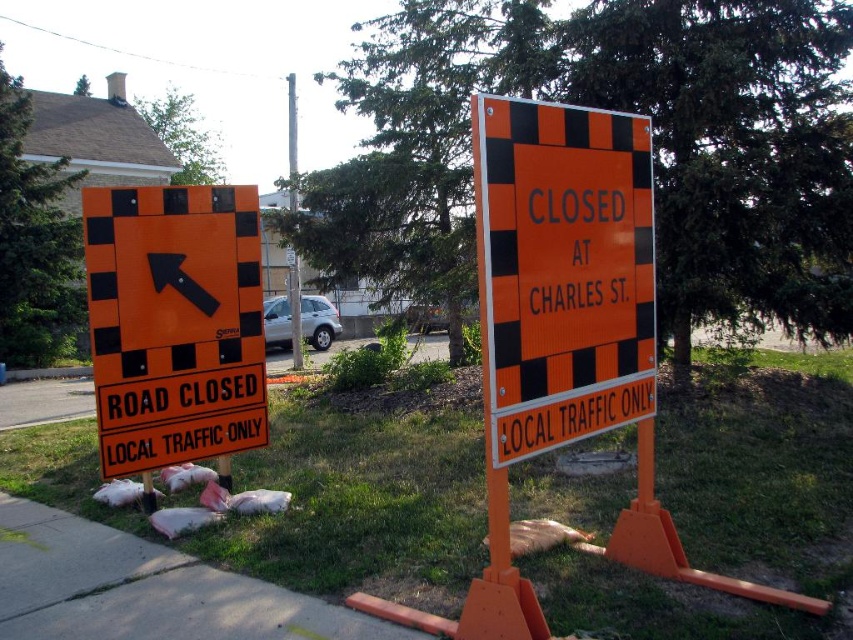
Does orange reflective road sign at left lie in front of brushed metal pole at center?

That is True.

Does orange reflective road sign at left have a greater width compared to brushed metal pole at center?

Incorrect, orange reflective road sign at left's width does not surpass brushed metal pole at center's.

Does point (218, 240) come in front of point (296, 337)?

Yes, it is.

Where is `orange reflective road sign at left`? Image resolution: width=853 pixels, height=640 pixels. orange reflective road sign at left is located at coordinates (173, 323).

Does orange reflective road sign at left lie in front of smooth concrete sidewalk at lower left?

No, it is behind smooth concrete sidewalk at lower left.

Can you confirm if orange reflective road sign at left is thinner than smooth concrete sidewalk at lower left?

Correct, orange reflective road sign at left's width is less than smooth concrete sidewalk at lower left's.

Which is behind, point (126, 444) or point (102, 630)?

The point (126, 444) is behind.

Where is `orange reflective road sign at left`? orange reflective road sign at left is located at coordinates (173, 323).

Can you confirm if orange/black checkered sign at center is positioned to the right of brushed metal pole at center?

Yes, orange/black checkered sign at center is to the right of brushed metal pole at center.

Can you confirm if orange/black checkered sign at center is wider than brushed metal pole at center?

Incorrect, orange/black checkered sign at center's width does not surpass brushed metal pole at center's.

You are a GUI agent. You are given a task and a screenshot of the screen. Output one action in this format:
    pyautogui.click(x=<x>, y=<y>)
    Task: Click on the orange/black checkered sign at center
    This screenshot has width=853, height=640.
    Given the screenshot: What is the action you would take?
    pyautogui.click(x=561, y=272)